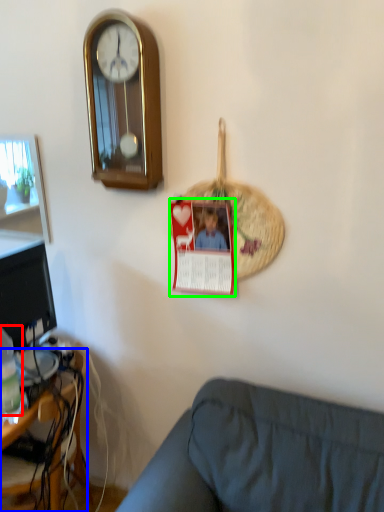
Question: Which object is positioned farthest from bottle (highlighted by a red box)? Select from desk (highlighted by a blue box) and postcard (highlighted by a green box).

Choices:
 (A) desk
 (B) postcard

Answer: (B)